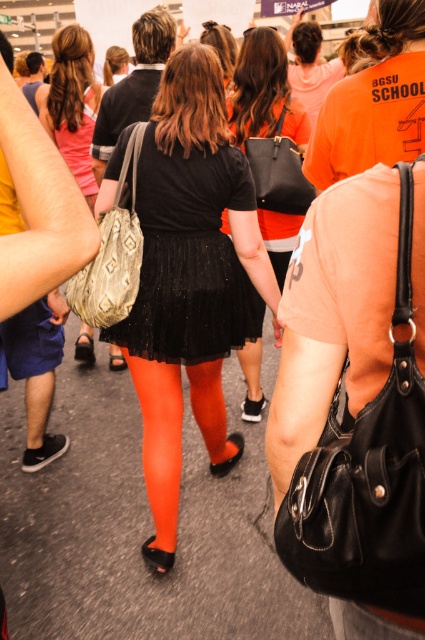
In the scene described, where is the black glittery skirt at center located in terms of coordinates?

The black glittery skirt at center is located at coordinates point (189, 259).

You are standing in the scene and want to find the black glitter skirt at center. According to the coordinates provided, where should you look relative to the woman in the foreground?

The black glitter skirt at center is located at coordinates point (189,280), which places it slightly to the right and below the woman in the foreground.